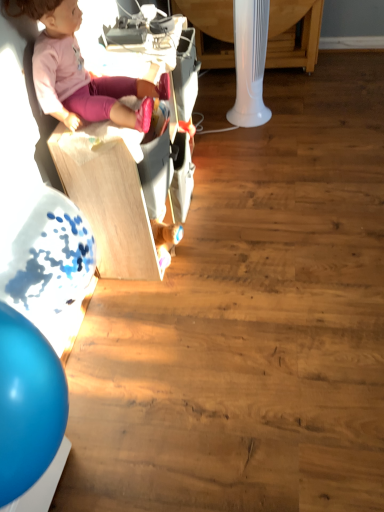
Question: Is the position of white plastic table at upper center less distant than that of wooden toy box at upper left?

Choices:
 (A) yes
 (B) no

Answer: (B)

Question: Can you confirm if white plastic table at upper center is shorter than wooden toy box at upper left?

Choices:
 (A) no
 (B) yes

Answer: (B)

Question: From a real-world perspective, is white plastic table at upper center positioned under wooden toy box at upper left based on gravity?

Choices:
 (A) yes
 (B) no

Answer: (A)

Question: From the image's perspective, is white plastic table at upper center located beneath wooden toy box at upper left?

Choices:
 (A) no
 (B) yes

Answer: (A)

Question: Is white plastic table at upper center facing towards wooden toy box at upper left?

Choices:
 (A) no
 (B) yes

Answer: (B)

Question: Does point (33, 10) appear closer or farther from the camera than point (105, 243)?

Choices:
 (A) closer
 (B) farther

Answer: (A)

Question: From a real-world perspective, is pink fabric doll at upper left physically located above or below wooden toy box at upper left?

Choices:
 (A) above
 (B) below

Answer: (A)

Question: Considering their positions, is pink fabric doll at upper left located in front of or behind wooden toy box at upper left?

Choices:
 (A) behind
 (B) front

Answer: (B)

Question: Is pink fabric doll at upper left to the left or to the right of wooden toy box at upper left in the image?

Choices:
 (A) left
 (B) right

Answer: (A)

Question: From their relative heights in the image, would you say white plastic table at upper center is taller or shorter than wooden toy box at upper left?

Choices:
 (A) tall
 (B) short

Answer: (B)

Question: Looking at their shapes, would you say white plastic table at upper center is wider or thinner than wooden toy box at upper left?

Choices:
 (A) thin
 (B) wide

Answer: (B)

Question: Would you say white plastic table at upper center is to the left or to the right of wooden toy box at upper left in the picture?

Choices:
 (A) left
 (B) right

Answer: (B)

Question: From the image's perspective, is white plastic table at upper center above or below wooden toy box at upper left?

Choices:
 (A) above
 (B) below

Answer: (A)

Question: Relative to pink fabric doll at upper left, is wooden toy box at upper left in front or behind?

Choices:
 (A) front
 (B) behind

Answer: (B)

Question: Is wooden toy box at upper left taller or shorter than pink fabric doll at upper left?

Choices:
 (A) tall
 (B) short

Answer: (A)